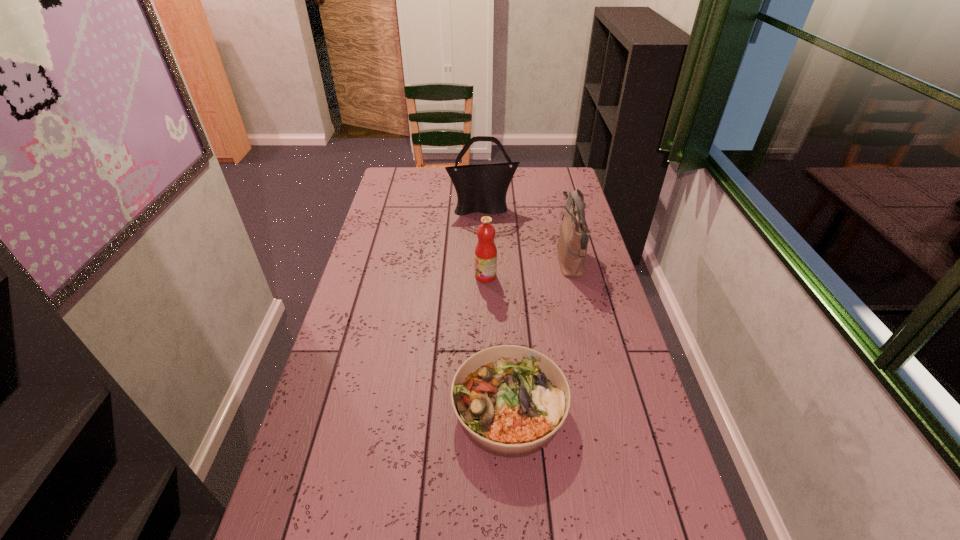
Locate an element on the screen. object that is the third closest to the farthest object is located at coordinates (511, 400).

Where is `free space that satisfies the following two spatial constraints: 1. on the back side of the salad plate; 2. on the front label of the second shortest object`? The image size is (960, 540). free space that satisfies the following two spatial constraints: 1. on the back side of the salad plate; 2. on the front label of the second shortest object is located at coordinates (502, 276).

Identify the location of free spot that satisfies the following two spatial constraints: 1. on the front label of the fruit juice; 2. on the right side of the salad plate. (488, 409).